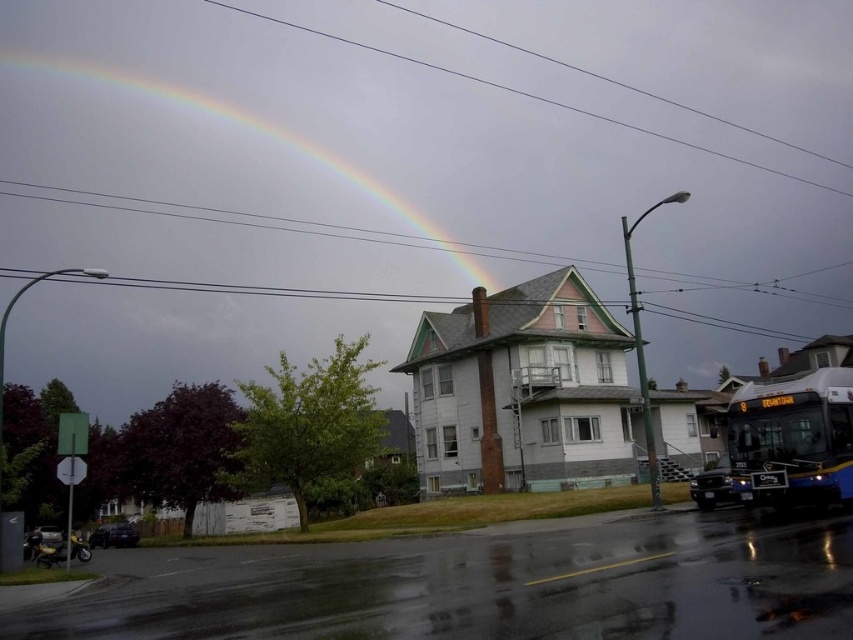
Between blue metallic bus at lower right and rainbow at upper left, which one is positioned lower?

blue metallic bus at lower right is below.

Can you confirm if blue metallic bus at lower right is positioned below rainbow at upper left?

Indeed, blue metallic bus at lower right is positioned under rainbow at upper left.

Which is in front, point (833, 381) or point (460, 260)?

Point (833, 381) is in front.

I want to click on blue metallic bus at lower right, so click(x=792, y=440).